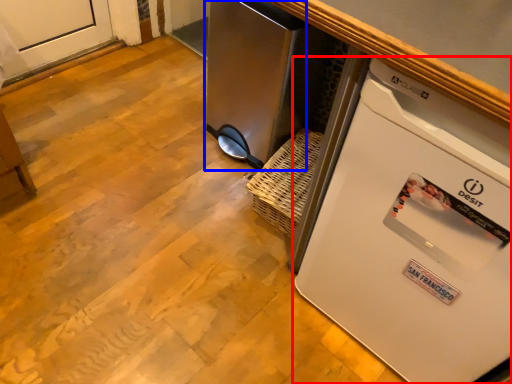
Question: Which point is closer to the camera, home appliance (highlighted by a red box) or appliance (highlighted by a blue box)?

Choices:
 (A) home appliance
 (B) appliance

Answer: (A)